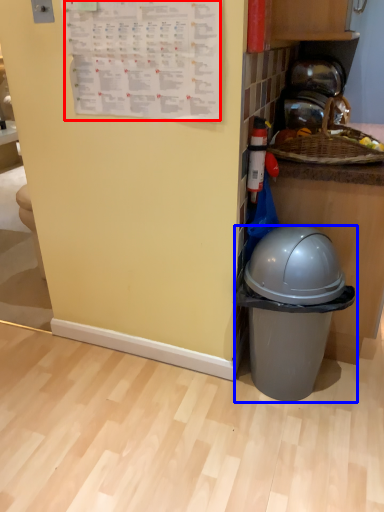
Question: Which object is closer to the camera taking this photo, writing (highlighted by a red box) or waste container (highlighted by a blue box)?

Choices:
 (A) writing
 (B) waste container

Answer: (A)